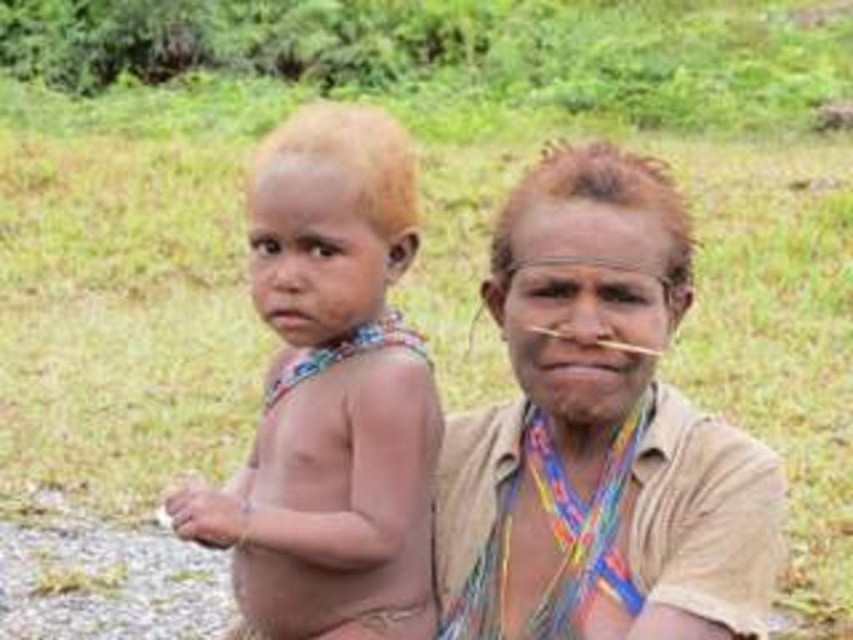
Consider the image. Can you confirm if brown textured cloth at center is bigger than light brown hair at center?

Correct, brown textured cloth at center is larger in size than light brown hair at center.

Can you confirm if brown textured cloth at center is shorter than light brown hair at center?

Correct, brown textured cloth at center is not as tall as light brown hair at center.

Which is in front, point (465, 609) or point (430, 403)?

Point (465, 609) is in front.

Locate an element on the screen. This screenshot has width=853, height=640. brown textured cloth at center is located at coordinates (599, 433).